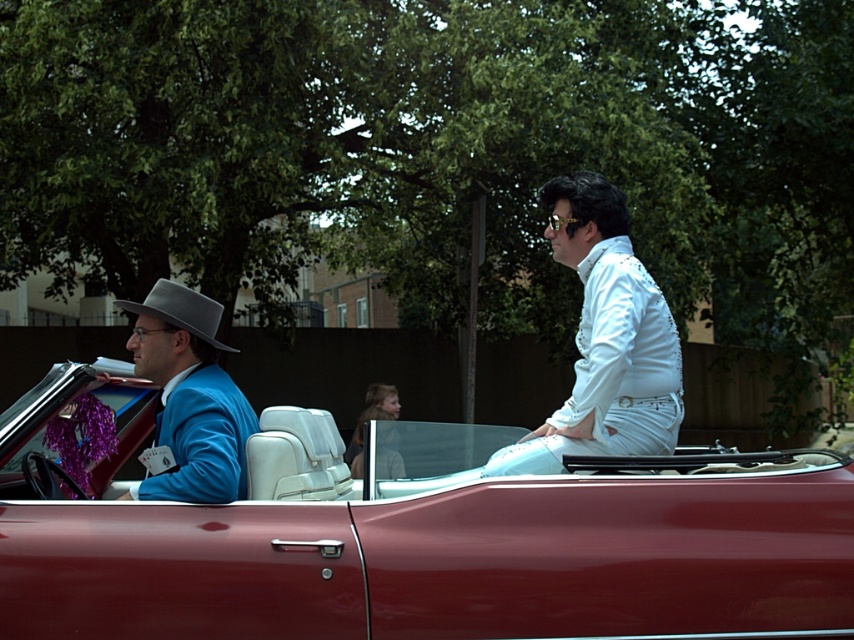
Which is above, shiny red car at center or blue velvet suit at left?

Positioned higher is blue velvet suit at left.

Can you confirm if shiny red car at center is positioned below blue velvet suit at left?

Indeed, shiny red car at center is positioned under blue velvet suit at left.

Which is behind, point (776, 548) or point (254, 417)?

The point (254, 417) is more distant.

Where is `shiny red car at center`? shiny red car at center is located at coordinates (417, 536).

Which is more to the left, shiny red car at center or white sequined jacket at right?

From the viewer's perspective, shiny red car at center appears more on the left side.

Who is taller, shiny red car at center or white sequined jacket at right?

white sequined jacket at right

Is point (445, 493) positioned after point (601, 237)?

That is False.

I want to click on shiny red car at center, so click(417, 536).

Is blue velvet suit at left positioned at the back of light brown hair at center?

That is False.

Where is `blue velvet suit at left`? blue velvet suit at left is located at coordinates (190, 396).

Where is `blue velvet suit at left`? The height and width of the screenshot is (640, 854). blue velvet suit at left is located at coordinates (190, 396).